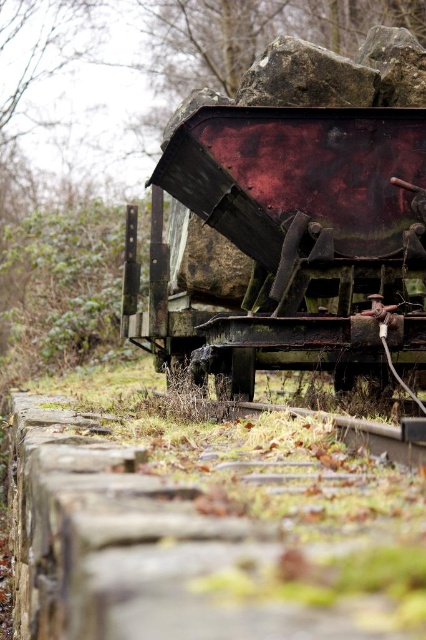
You are standing at the edge of the abandoned railway scene. You want to cross to the other side of the tracks but need to avoid the rusty metal train car at center. What is the minimum distance you must walk around it to reach the other side?

The minimum distance you must walk around the rusty metal train car at center is 3.88 meters, as that is the distance between you and the train car.

You are a maintenance worker assessing the abandoned railway scene. You notice the rusty metal train car at center and the rusty metal rock at upper center. Based on their positions, which object is located above the other?

The rusty metal rock at upper center is above the rusty metal train car at center because it is positioned over it.

You are a maintenance worker needing to reach the rusty metal rock at upper center from the rusty metal train car at center. Given that your tool kit is 1.8 meters long, can you safely extend it to reach the rock without moving from the train car?

The distance between the rusty metal train car at center and the rusty metal rock at upper center is 1.86 meters. Since your tool kit is only 1.8 meters long, it is 6 centimeters short. Therefore, you cannot safely reach the rock without moving from the train car.